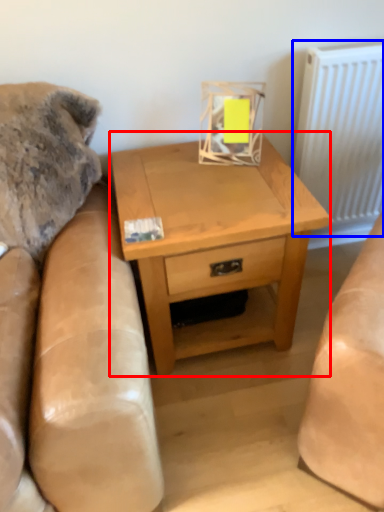
Question: Which of the following is the closest to the observer, nightstand (highlighted by a red box) or radiator (highlighted by a blue box)?

Choices:
 (A) nightstand
 (B) radiator

Answer: (A)